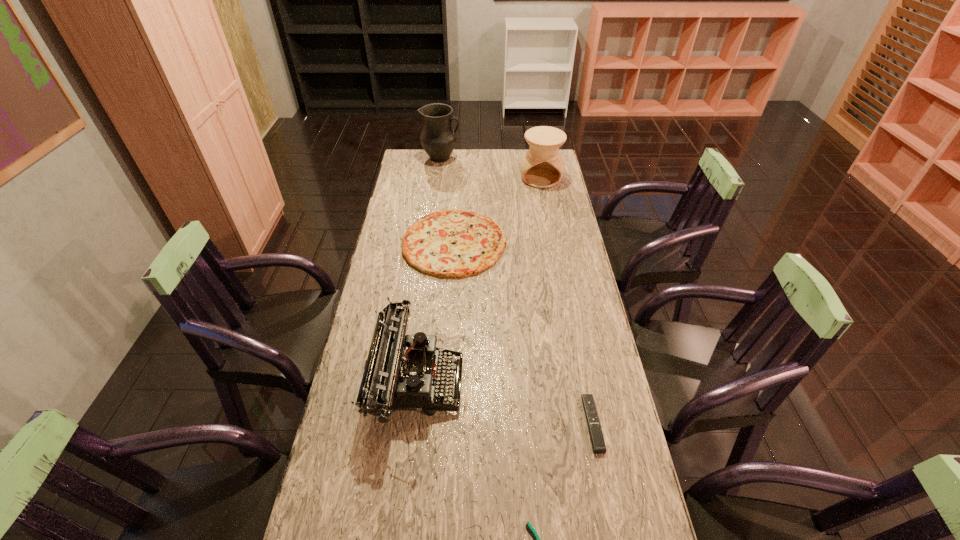
The height and width of the screenshot is (540, 960). Find the location of `vacant space located 0.150m on the back of the remote control`. vacant space located 0.150m on the back of the remote control is located at coordinates (579, 353).

This screenshot has height=540, width=960. In order to click on pitcher situated at the far edge in this screenshot , I will do `click(438, 139)`.

At what (x,y) coordinates should I click in order to perform the action: click on pottery present at the far edge. Please return your answer as a coordinate pair (x, y). The height and width of the screenshot is (540, 960). Looking at the image, I should click on (542, 166).

Locate an element on the screen. pitcher present at the left edge is located at coordinates (438, 139).

This screenshot has width=960, height=540. Identify the location of typewriter that is positioned at the left edge. (402, 372).

Find the location of a particular element. Image resolution: width=960 pixels, height=540 pixels. pizza present at the left edge is located at coordinates (451, 243).

Where is `pottery positioned at the right edge`? pottery positioned at the right edge is located at coordinates (542, 166).

At what (x,y) coordinates should I click in order to perform the action: click on remote control located at the right edge. Please return your answer as a coordinate pair (x, y). Looking at the image, I should click on (596, 436).

The image size is (960, 540). Find the location of `object positioned at the far left corner`. object positioned at the far left corner is located at coordinates (438, 139).

Image resolution: width=960 pixels, height=540 pixels. I want to click on object that is at the far right corner, so click(x=542, y=166).